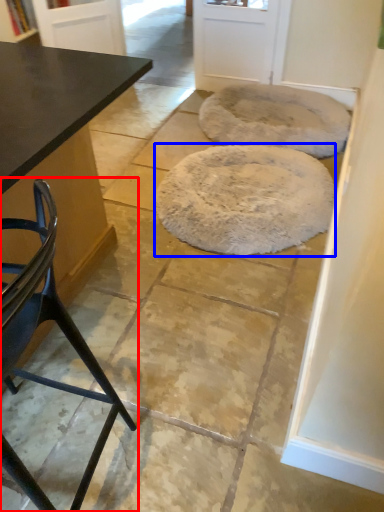
Question: Among these objects, which one is nearest to the camera, chair (highlighted by a red box) or mat (highlighted by a blue box)?

Choices:
 (A) chair
 (B) mat

Answer: (A)